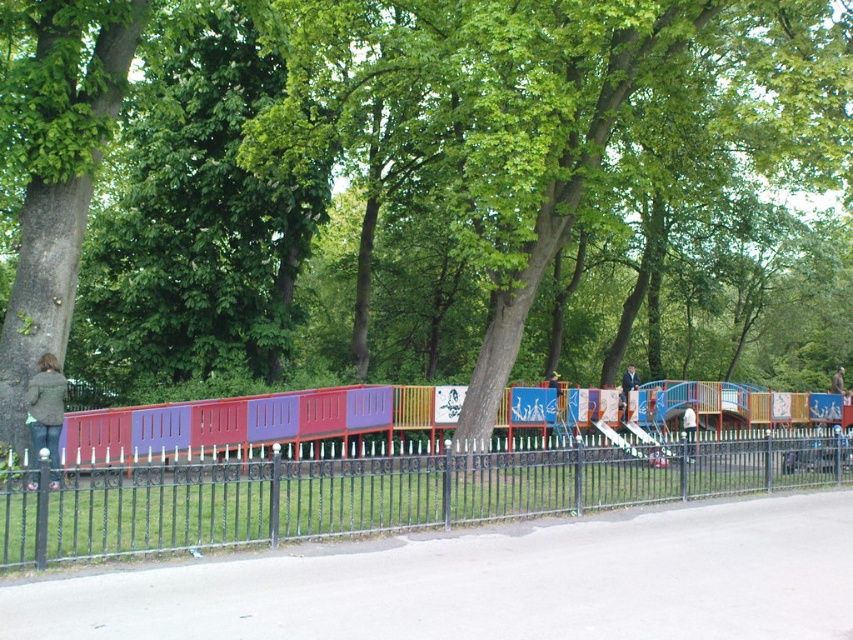
Question: Is multicolored wooden train at center further to camera compared to white fabric jacket at center?

Choices:
 (A) no
 (B) yes

Answer: (A)

Question: Which object appears closest to the camera in this image?

Choices:
 (A) black metal fence at center
 (B) brown leather jacket at upper center

Answer: (A)

Question: Does white fabric jacket at center come in front of brown leather jacket at upper center?

Choices:
 (A) yes
 (B) no

Answer: (A)

Question: Among these points, which one is farthest from the camera?

Choices:
 (A) (387, 490)
 (B) (637, 387)

Answer: (B)

Question: Is multicolored wooden train at center positioned at the back of white fabric jacket at center?

Choices:
 (A) no
 (B) yes

Answer: (A)

Question: Which object is positioned farthest from the multicolored wooden train at center?

Choices:
 (A) brown leather jacket at upper center
 (B) blue plastic slide at center
 (C) black metal fence at center
 (D) white fabric jacket at center

Answer: (A)